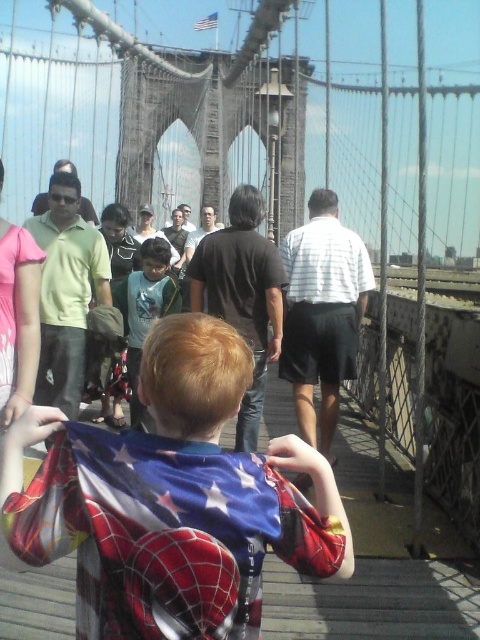
Question: Does light blue shirt at center come in front of white fabric flag at upper center?

Choices:
 (A) yes
 (B) no

Answer: (A)

Question: Observing the image, what is the correct spatial positioning of light blue shirt at center in reference to white fabric flag at upper center?

Choices:
 (A) below
 (B) above

Answer: (A)

Question: Based on their relative distances, which object is nearer to the white fabric flag at upper center?

Choices:
 (A) light blue shirt at center
 (B) spiderman costume at center

Answer: (A)

Question: Among these points, which one is nearest to the camera?

Choices:
 (A) (166, 264)
 (B) (259, 541)
 (C) (205, 22)

Answer: (B)

Question: Is spiderman costume at center in front of white fabric flag at upper center?

Choices:
 (A) no
 (B) yes

Answer: (B)

Question: Which object is positioned closest to the spiderman costume at center?

Choices:
 (A) light blue shirt at center
 (B) white fabric flag at upper center

Answer: (A)